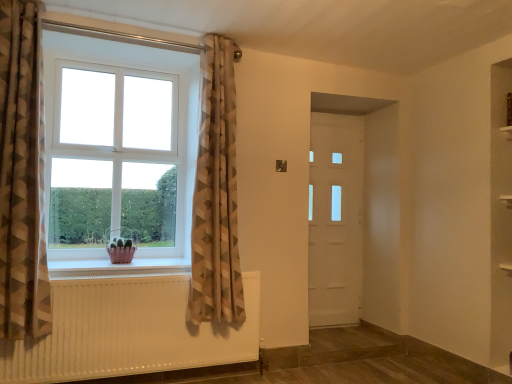
Where is `white textured radiator at lower left`? white textured radiator at lower left is located at coordinates (128, 331).

This screenshot has width=512, height=384. What do you see at coordinates (216, 193) in the screenshot?
I see `neutral geometric fabric curtain at upper left, which is the 2th curtain in front-to-back order` at bounding box center [216, 193].

Measure the distance between white matte door at center and camera.

white matte door at center and camera are 3.80 meters apart.

In the scene shown: Measure the distance between brown geometric fabric curtain at left, the 1th curtain in the left-to-right sequence, and camera.

brown geometric fabric curtain at left, the 1th curtain in the left-to-right sequence, and camera are 7.50 feet apart from each other.

At what (x,y) coordinates should I click in order to perform the action: click on pink plastic basket at lower left. Please return your answer as a coordinate pair (x, y). Looking at the image, I should click on (116, 267).

Considering the positions of objects white textured radiator at lower left and brown geometric fabric curtain at left, which is the 2th curtain from back to front, in the image provided, who is in front, white textured radiator at lower left or brown geometric fabric curtain at left, which is the 2th curtain from back to front,?

brown geometric fabric curtain at left, which is the 2th curtain from back to front, is closer to the camera.

Would you say white textured radiator at lower left is inside or outside brown geometric fabric curtain at left, the 1th curtain in the left-to-right sequence?

white textured radiator at lower left is not inside brown geometric fabric curtain at left, the 1th curtain in the left-to-right sequence, it's outside.

From the picture: From a real-world perspective, is white textured radiator at lower left over brown geometric fabric curtain at left, the 1th curtain in the left-to-right sequence?

No.

Identify the location of curtain located in front of the white textured radiator at lower left. click(22, 175).

How many degrees apart are the facing directions of brown geometric fabric curtain at left, arranged as the 1th curtain when viewed from the front, and white textured radiator at lower left?

There is a 1.35-degree angle between the facing directions of brown geometric fabric curtain at left, arranged as the 1th curtain when viewed from the front, and white textured radiator at lower left.

Are brown geometric fabric curtain at left, arranged as the 1th curtain when viewed from the front, and white textured radiator at lower left beside each other?

No, brown geometric fabric curtain at left, arranged as the 1th curtain when viewed from the front, is not beside white textured radiator at lower left.

Considering the positions of points (15, 57) and (72, 288), is point (15, 57) farther from camera compared to point (72, 288)?

That is False.

Which object is thinner, brown geometric fabric curtain at left, the 1th curtain in the left-to-right sequence, or white textured radiator at lower left?

white textured radiator at lower left is thinner.

Find the location of `the 2nd curtain positioned above the pink plastic basket at lower left (from the image's perspective)`. the 2nd curtain positioned above the pink plastic basket at lower left (from the image's perspective) is located at coordinates (22, 175).

In terms of width, does brown geometric fabric curtain at left, arranged as the 1th curtain when viewed from the front, look wider or thinner when compared to pink plastic basket at lower left?

Clearly, brown geometric fabric curtain at left, arranged as the 1th curtain when viewed from the front, has less width compared to pink plastic basket at lower left.

From a real-world perspective, is brown geometric fabric curtain at left, arranged as the 1th curtain when viewed from the front, above or below pink plastic basket at lower left?

Clearly, from a real-world perspective, brown geometric fabric curtain at left, arranged as the 1th curtain when viewed from the front, is above pink plastic basket at lower left.

Can you confirm if brown geometric fabric curtain at left, arranged as the 1th curtain when viewed from the front, is taller than pink plastic basket at lower left?

Correct, brown geometric fabric curtain at left, arranged as the 1th curtain when viewed from the front, is much taller as pink plastic basket at lower left.

Could you tell me if pink plastic basket at lower left is facing brown geometric fabric curtain at left, the 1th curtain in the left-to-right sequence?

No, pink plastic basket at lower left is not facing towards brown geometric fabric curtain at left, the 1th curtain in the left-to-right sequence.

From a real-world perspective, which object stands above the other?

brown geometric fabric curtain at left, the 1th curtain in the left-to-right sequence.

Considering the positions of objects pink plastic basket at lower left and brown geometric fabric curtain at left, the 1th curtain in the left-to-right sequence, in the image provided, who is more to the right, pink plastic basket at lower left or brown geometric fabric curtain at left, the 1th curtain in the left-to-right sequence,?

pink plastic basket at lower left is more to the right.

In terms of width, does pink plastic basket at lower left look wider or thinner when compared to brown geometric fabric curtain at left, arranged as the 1th curtain when viewed from the front?

In the image, pink plastic basket at lower left appears to be wider than brown geometric fabric curtain at left, arranged as the 1th curtain when viewed from the front.

Considering their positions, is white matte door at center located in front of or behind brown geometric fabric curtain at left, arranged as the 1th curtain when viewed from the front?

In the image, white matte door at center appears behind brown geometric fabric curtain at left, arranged as the 1th curtain when viewed from the front.

Are white matte door at center and brown geometric fabric curtain at left, the 1th curtain in the left-to-right sequence, far apart?

white matte door at center is positioned a significant distance from brown geometric fabric curtain at left, the 1th curtain in the left-to-right sequence.

From the image's perspective, is white matte door at center over brown geometric fabric curtain at left, which is the 2th curtain from back to front?

Incorrect, from the image's perspective, white matte door at center is lower than brown geometric fabric curtain at left, which is the 2th curtain from back to front.

Could you measure the distance between white matte door at center and brown geometric fabric curtain at left, the 1th curtain in the left-to-right sequence?

They are 2.44 meters apart.

From a real-world perspective, between neutral geometric fabric curtain at upper left, which is the 1th curtain in right-to-left order, and white plastic window at left, who is vertically higher?

white plastic window at left, from a real-world perspective.

Based on the photo, considering the relative sizes of neutral geometric fabric curtain at upper left, which ranks as the second curtain in left-to-right order, and white plastic window at left in the image provided, is neutral geometric fabric curtain at upper left, which ranks as the second curtain in left-to-right order, taller than white plastic window at left?

Yes.

Locate an element on the screen. curtain that is the 2nd object located below the white plastic window at left (from the image's perspective) is located at coordinates (216, 193).

Can you tell me how much neutral geometric fabric curtain at upper left, which ranks as the second curtain in left-to-right order, and white plastic window at left differ in facing direction?

There is a 1.51-degree angle between the facing directions of neutral geometric fabric curtain at upper left, which ranks as the second curtain in left-to-right order, and white plastic window at left.

Considering the positions of objects pink plastic basket at lower left and white plastic window at left in the image provided, who is behind, pink plastic basket at lower left or white plastic window at left?

white plastic window at left is more distant.

Which of these two, pink plastic basket at lower left or white plastic window at left, is thinner?

white plastic window at left.

Considering the relative sizes of pink plastic basket at lower left and white plastic window at left in the image provided, is pink plastic basket at lower left shorter than white plastic window at left?

Yes.

How much distance is there between pink plastic basket at lower left and white plastic window at left?

pink plastic basket at lower left and white plastic window at left are 24.29 inches apart from each other.

I want to click on radiator below the brown geometric fabric curtain at left, arranged as the 1th curtain when viewed from the front (from the image's perspective), so click(128, 331).

I want to click on radiator that appears behind the brown geometric fabric curtain at left, which appears as the 2th curtain when viewed from the right, so click(128, 331).

Considering their positions, is white matte door at center positioned closer to white plastic window at left than white textured radiator at lower left?

white textured radiator at lower left lies closer to white plastic window at left than the other object.

Which object lies nearer to the anchor point white plastic window at left, brown geometric fabric curtain at left, which is the 2th curtain from back to front, or pink plastic basket at lower left?

brown geometric fabric curtain at left, which is the 2th curtain from back to front, is closer to white plastic window at left.

Considering their positions, is brown geometric fabric curtain at left, arranged as the 1th curtain when viewed from the front, positioned closer to white textured radiator at lower left than pink plastic basket at lower left?

Based on the image, pink plastic basket at lower left appears to be nearer to white textured radiator at lower left.

Considering their positions, is pink plastic basket at lower left positioned further to brown geometric fabric curtain at left, which is the 2th curtain from back to front, than white textured radiator at lower left?

Among the two, white textured radiator at lower left is located further to brown geometric fabric curtain at left, which is the 2th curtain from back to front.

From the image, which object appears to be farther from white plastic window at left, pink plastic basket at lower left or brown geometric fabric curtain at left, which appears as the 2th curtain when viewed from the right?

Based on the image, pink plastic basket at lower left appears to be further to white plastic window at left.

From the image, which object appears to be farther from white plastic window at left, white textured radiator at lower left or pink plastic basket at lower left?

white textured radiator at lower left lies further to white plastic window at left than the other object.

Based on their spatial positions, is neutral geometric fabric curtain at upper left, which is the 1th curtain in right-to-left order, or brown geometric fabric curtain at left, arranged as the 1th curtain when viewed from the front, closer to white plastic window at left?

neutral geometric fabric curtain at upper left, which is the 1th curtain in right-to-left order.

Looking at this image, estimate the real-world distances between objects in this image. Which object is closer to pink plastic basket at lower left, white matte door at center or white textured radiator at lower left?

white textured radiator at lower left.

I want to click on window sill between brown geometric fabric curtain at left, the 1th curtain in the left-to-right sequence, and white matte door at center, in the horizontal direction, so click(x=116, y=267).

Locate an element on the screen. window sill that lies between neutral geometric fabric curtain at upper left, which ranks as the second curtain in left-to-right order, and white textured radiator at lower left from top to bottom is located at coordinates (116, 267).

This screenshot has width=512, height=384. In order to click on radiator located between pink plastic basket at lower left and white matte door at center in the left-right direction in this screenshot , I will do `click(128, 331)`.

Identify the location of window sill between brown geometric fabric curtain at left, which is the 2th curtain from back to front, and white textured radiator at lower left in the up-down direction. (116, 267).